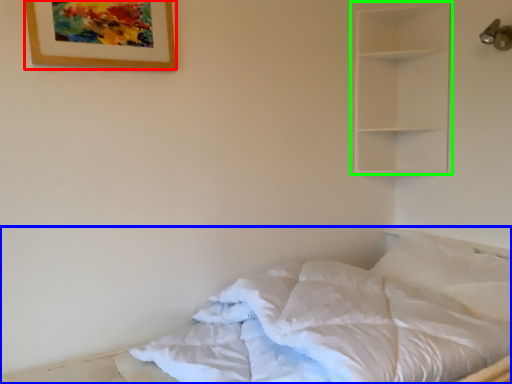
Question: Estimate the real-world distances between objects in this image. Which object is closer to picture frame (highlighted by a red box), bed (highlighted by a blue box) or shelf (highlighted by a green box)?

Choices:
 (A) bed
 (B) shelf

Answer: (A)